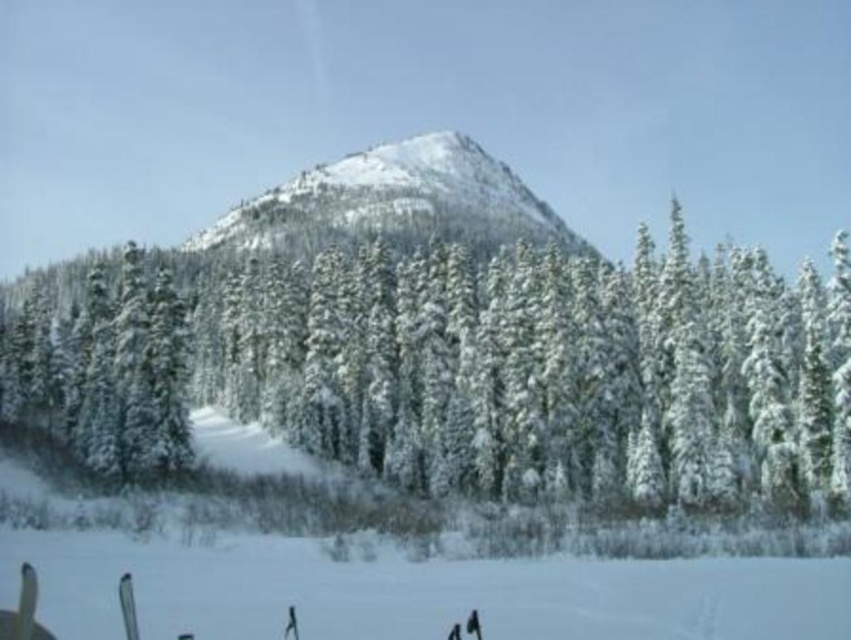
Does snow-covered evergreen at center have a lesser width compared to snowy rocky peak at center?

In fact, snow-covered evergreen at center might be wider than snowy rocky peak at center.

Does point (444, 483) come in front of point (530, 224)?

Yes, point (444, 483) is in front of point (530, 224).

Where is `snow-covered evergreen at center`? The height and width of the screenshot is (640, 851). snow-covered evergreen at center is located at coordinates (463, 369).

Measure the distance from snow-covered evergreen at center to white snow ski slope at lower center.

snow-covered evergreen at center is 128.77 feet from white snow ski slope at lower center.

Which is more to the right, snow-covered evergreen at center or white snow ski slope at lower center?

Positioned to the right is white snow ski slope at lower center.

At what (x,y) coordinates should I click in order to perform the action: click on snow-covered evergreen at center. Please return your answer as a coordinate pair (x, y). Looking at the image, I should click on (463, 369).

In the scene shown: Who is taller, white snow ski slope at lower center or snowy rocky peak at center?

snowy rocky peak at center is taller.

Does point (303, 529) lie in front of point (340, 195)?

Yes, it is in front of point (340, 195).

At what (x,y) coordinates should I click in order to perform the action: click on white snow ski slope at lower center. Please return your answer as a coordinate pair (x, y). Looking at the image, I should click on (377, 579).